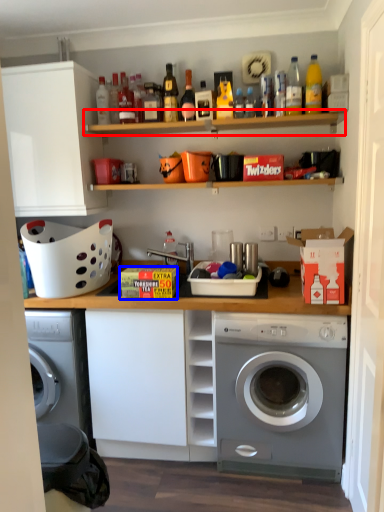
Question: Which object appears farthest to the camera in this image, shelf (highlighted by a red box) or cardboard box (highlighted by a blue box)?

Choices:
 (A) shelf
 (B) cardboard box

Answer: (A)